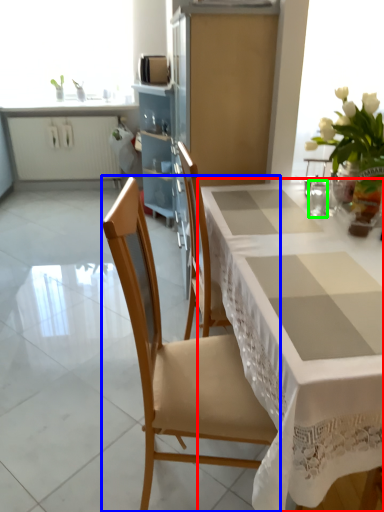
Question: Which object is positioned closest to table (highlighted by a red box)? Select from chair (highlighted by a blue box) and tableware (highlighted by a green box).

Choices:
 (A) chair
 (B) tableware

Answer: (A)